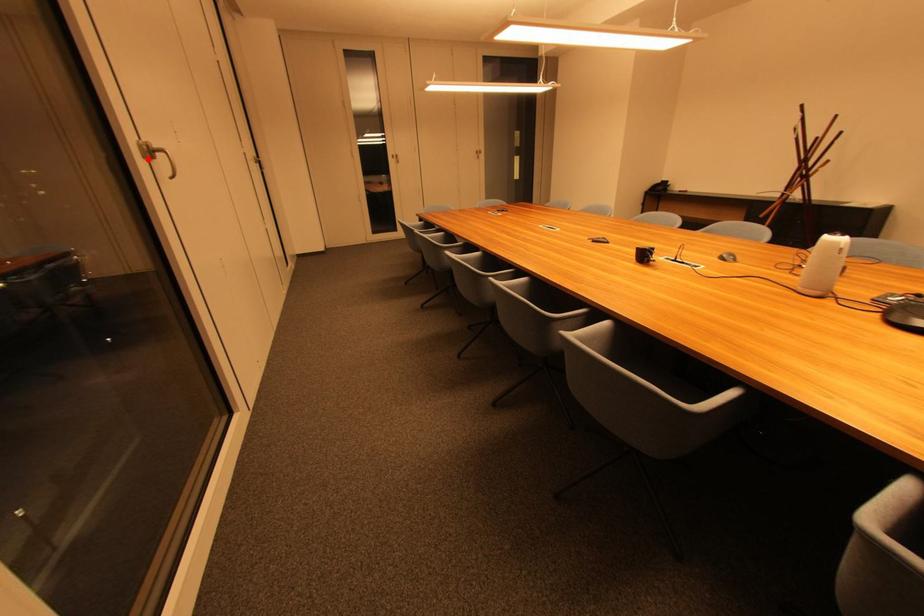
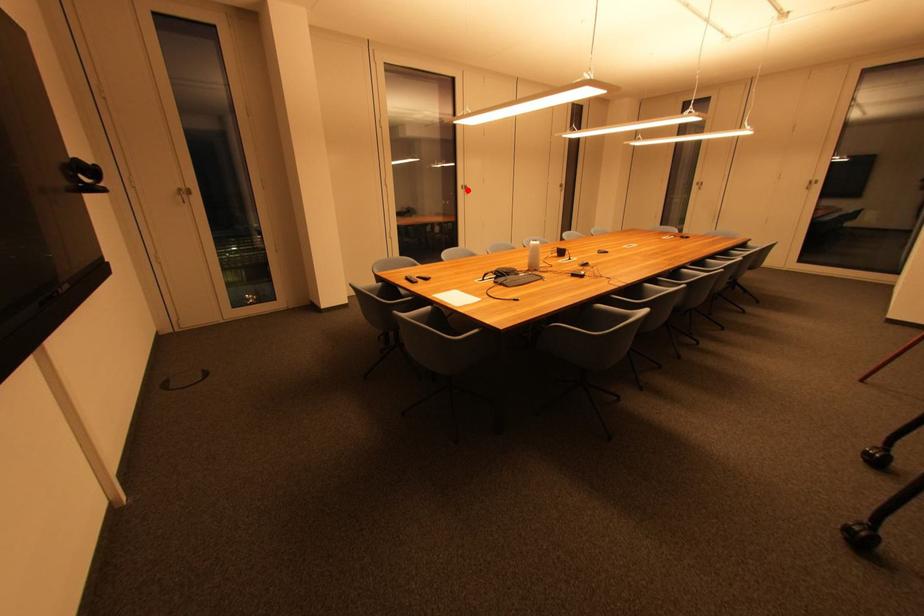
I am providing you with two images of the same scene from different viewpoints. A red point is marked on the first image and another point is marked on the second image. Is the marked point in image1 the same physical position as the marked point in image2?

Yes